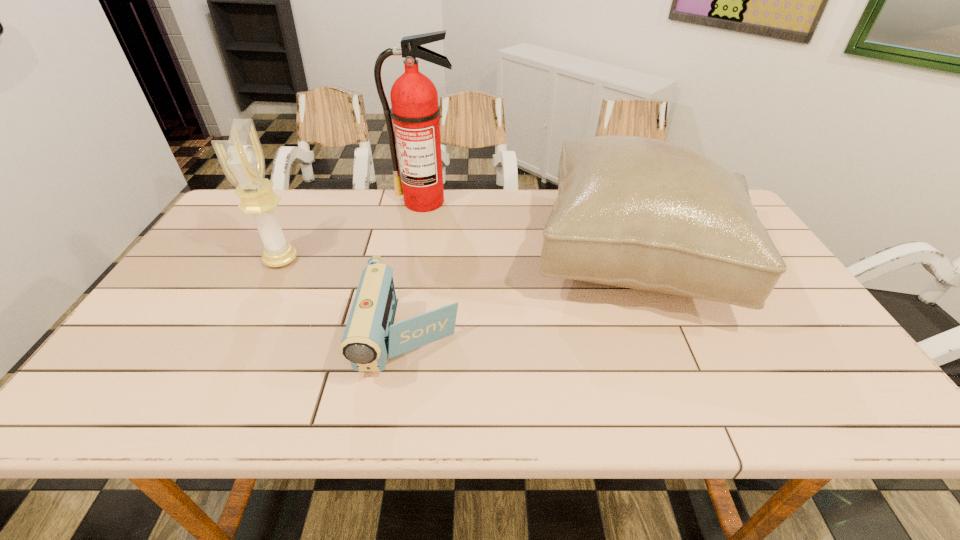
Find the location of a particular element. Image resolution: width=960 pixels, height=540 pixels. fire extinguisher located in the far edge section of the desktop is located at coordinates (414, 99).

At what (x,y) coordinates should I click in order to perform the action: click on cushion at the far edge. Please return your answer as a coordinate pair (x, y). This screenshot has height=540, width=960. Looking at the image, I should click on (635, 212).

Find the location of a particular element. This screenshot has width=960, height=540. object present at the near edge is located at coordinates (370, 338).

Locate an element on the screen. The width and height of the screenshot is (960, 540). object that is at the right edge is located at coordinates (635, 212).

At what (x,y) coordinates should I click in order to perform the action: click on object located in the far right corner section of the desktop. Please return your answer as a coordinate pair (x, y). Looking at the image, I should click on (635, 212).

What are the coordinates of `free space at the far edge of the desktop` in the screenshot? It's located at (310, 195).

Identify the location of vacant point at the near edge. The width and height of the screenshot is (960, 540). (609, 400).

At what (x,y) coordinates should I click in order to perform the action: click on free region at the left edge of the desktop. Please return your answer as a coordinate pair (x, y). The width and height of the screenshot is (960, 540). Looking at the image, I should click on (191, 301).

You are a GUI agent. You are given a task and a screenshot of the screen. Output one action in this format:
    pyautogui.click(x=<x>, y=<y>)
    Task: Click on the vacant space at the right edge of the desktop
    The image size is (960, 540).
    Given the screenshot: What is the action you would take?
    pyautogui.click(x=815, y=363)

Where is `vacant space at the near left corner of the desktop`? The height and width of the screenshot is (540, 960). vacant space at the near left corner of the desktop is located at coordinates (139, 390).